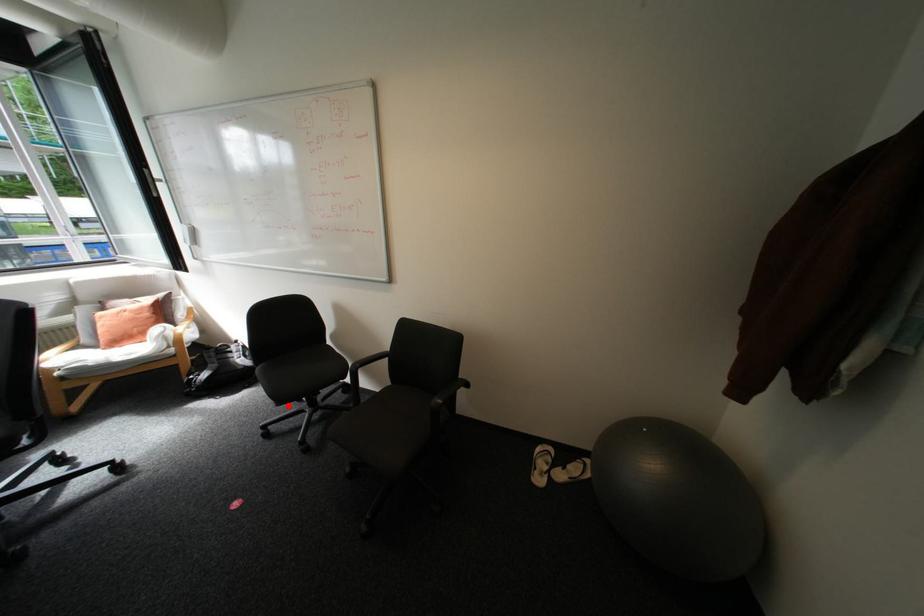
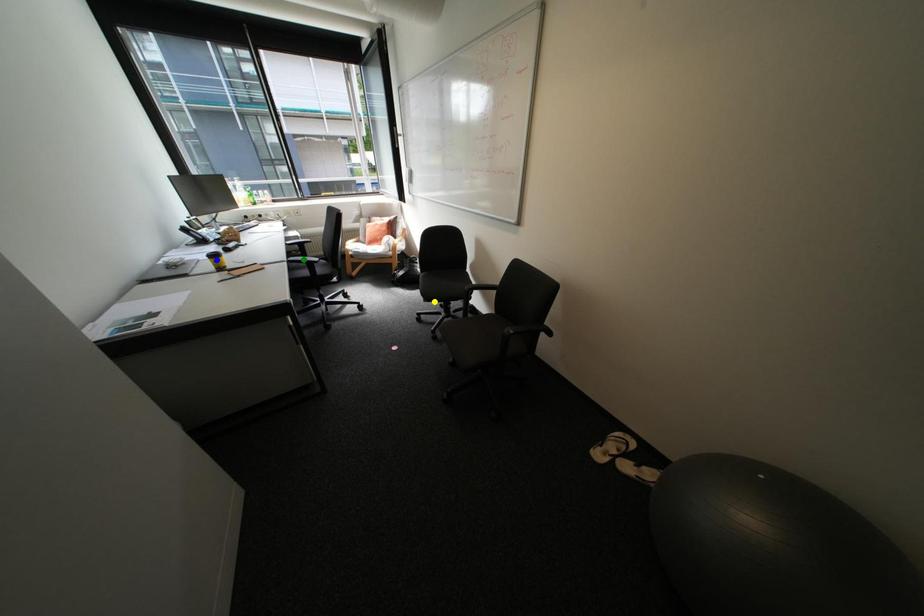
Question: I am providing you with two images of the same scene from different viewpoints. A red point is marked on the first image. You are given multiple points on the second image. Which point in image 2 is actually the same real-world point as the red point in image 1?

Choices:
 (A) green point
 (B) blue point
 (C) yellow point

Answer: (C)